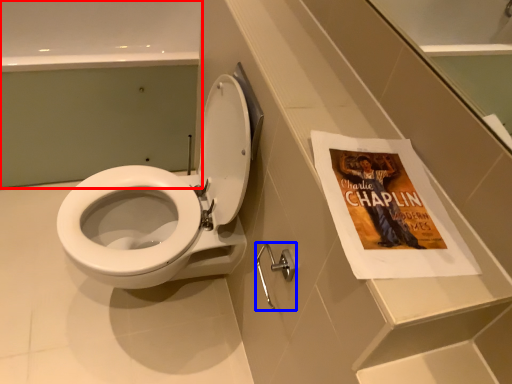
Question: Which of the following is the farthest to the observer, bath (highlighted by a red box) or towel bar (highlighted by a blue box)?

Choices:
 (A) bath
 (B) towel bar

Answer: (A)